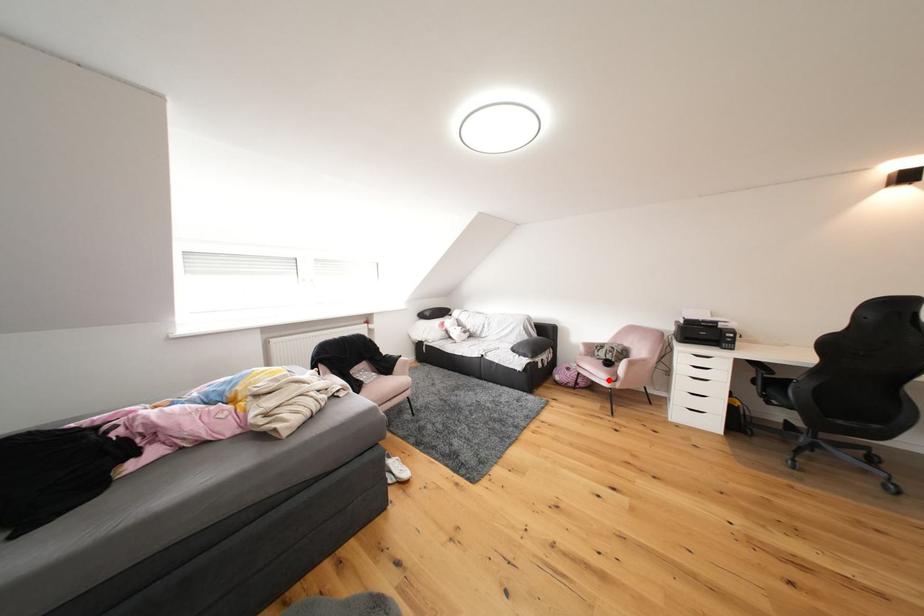
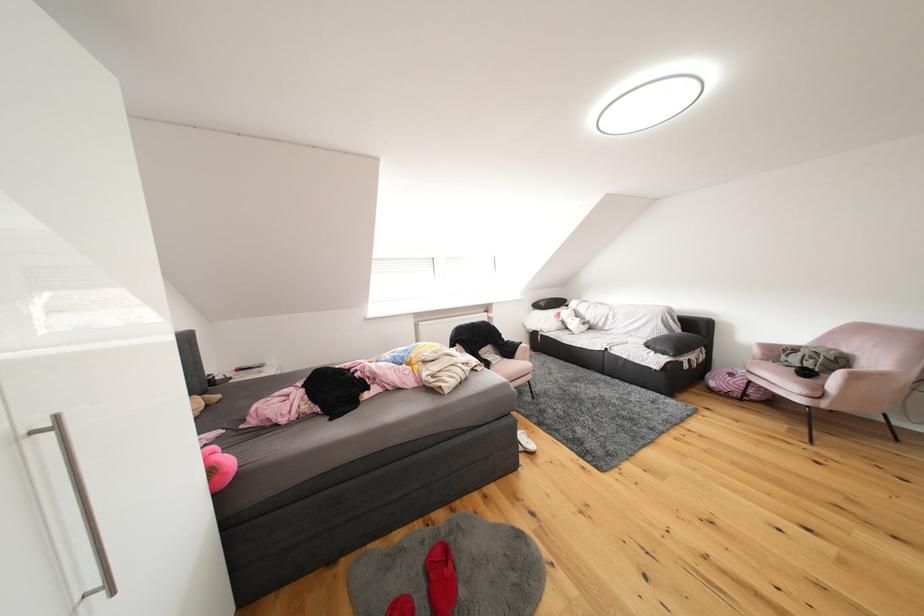
Question: I am providing you with two images of the same scene from different viewpoints. Image1 has a red point marked. In image2, the corresponding 3D location appears at what relative position? Reply with the corresponding letter.

Choices:
 (A) Closer
 (B) Farther

Answer: (B)